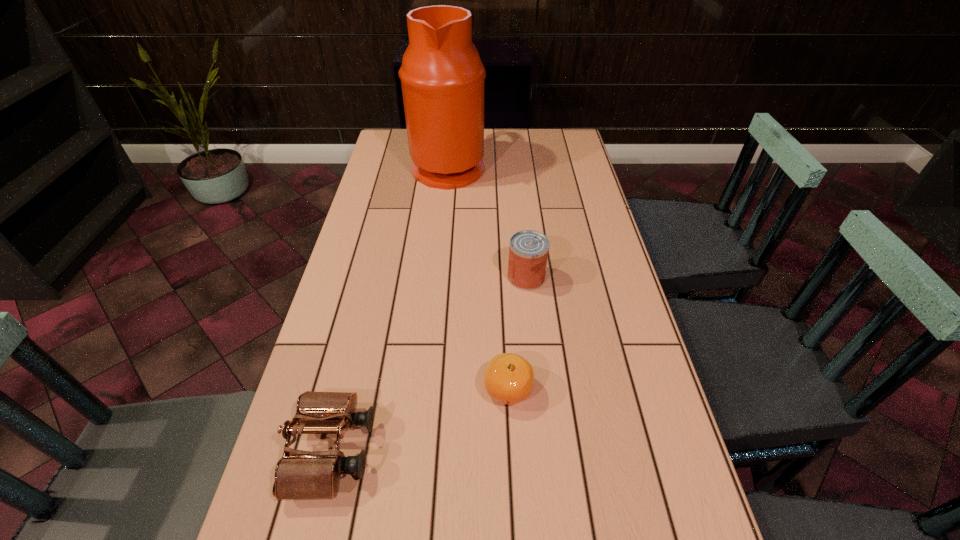
Locate an element on the screen. This screenshot has height=540, width=960. vacant space that is in between the clementine and the third nearest object is located at coordinates (517, 333).

Locate an element on the screen. The height and width of the screenshot is (540, 960). free space that is in between the third shortest object and the binoculars is located at coordinates (429, 363).

This screenshot has height=540, width=960. In order to click on empty location between the binoculars and the clementine in this screenshot , I will do `click(420, 420)`.

The height and width of the screenshot is (540, 960). Identify the location of unoccupied area between the third shortest object and the water jug. (488, 221).

This screenshot has height=540, width=960. Find the location of `empty space between the can and the binoculars`. empty space between the can and the binoculars is located at coordinates (429, 363).

You are a GUI agent. You are given a task and a screenshot of the screen. Output one action in this format:
    pyautogui.click(x=<x>, y=<y>)
    Task: Click on the free space between the tallest object and the clementine
    The height and width of the screenshot is (540, 960).
    Given the screenshot: What is the action you would take?
    pyautogui.click(x=478, y=278)

Where is `vacant area between the clementine and the water jug`? The height and width of the screenshot is (540, 960). vacant area between the clementine and the water jug is located at coordinates point(478,278).

I want to click on vacant space that's between the second tallest object and the water jug, so click(x=488, y=221).

Find the location of `vacant area that lies between the farthest object and the binoculars`. vacant area that lies between the farthest object and the binoculars is located at coordinates (390, 308).

Select which object is the closest to the clementine. Please provide its 2D coordinates. Your answer should be formatted as a tuple, i.e. [(x, y)], where the tuple contains the x and y coordinates of a point satisfying the conditions above.

[(299, 474)]